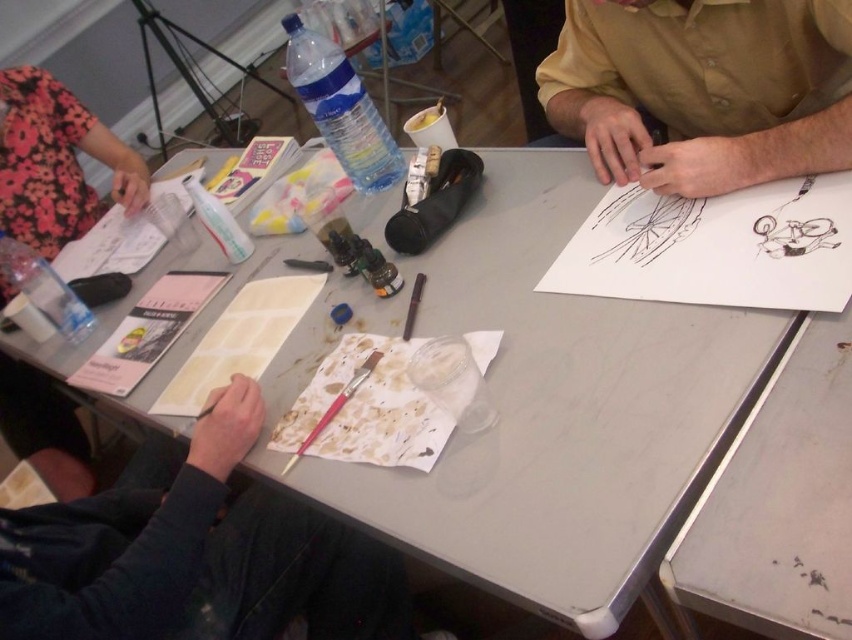
The width and height of the screenshot is (852, 640). What are the coordinates of `smooth black paper at lower left` in the screenshot? It's located at (194, 552).

Is smooth black paper at lower left wider than matte yellow shirt at upper right?

Yes, smooth black paper at lower left is wider than matte yellow shirt at upper right.

Is point (108, 612) closer to viewer compared to point (694, 3)?

Yes, point (108, 612) is closer to viewer.

Locate an element on the screen. The width and height of the screenshot is (852, 640). smooth black paper at lower left is located at coordinates (194, 552).